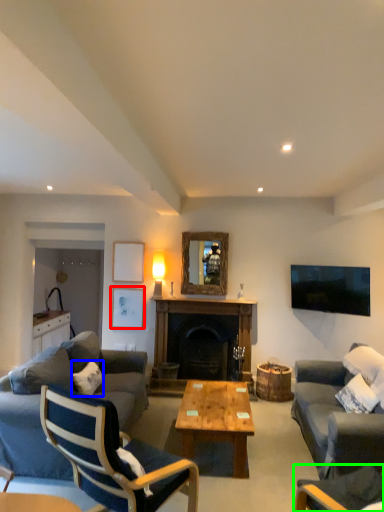
Question: Which object is the closest to the picture frame (highlighted by a red box)? Choose among these: pillow (highlighted by a blue box) or chair (highlighted by a green box).

Choices:
 (A) pillow
 (B) chair

Answer: (A)